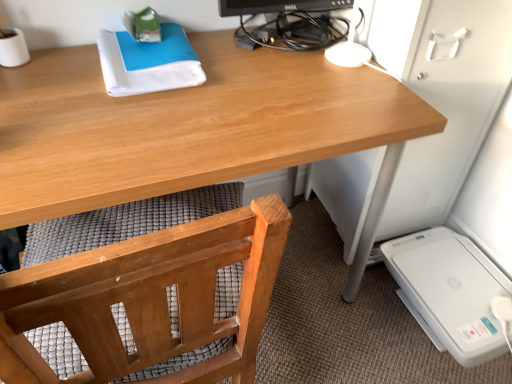
Question: Would you say wooden desk at center is outside white plastic printer at lower right?

Choices:
 (A) no
 (B) yes

Answer: (B)

Question: Does wooden desk at center contain white plastic printer at lower right?

Choices:
 (A) yes
 (B) no

Answer: (B)

Question: Considering the relative positions of wooden desk at center and white plastic printer at lower right in the image provided, is wooden desk at center in front of white plastic printer at lower right?

Choices:
 (A) no
 (B) yes

Answer: (B)

Question: Can you confirm if wooden desk at center is wider than white plastic printer at lower right?

Choices:
 (A) no
 (B) yes

Answer: (B)

Question: Is wooden desk at center oriented away from white plastic printer at lower right?

Choices:
 (A) yes
 (B) no

Answer: (B)

Question: Is wooden desk at center facing towards white plastic printer at lower right?

Choices:
 (A) no
 (B) yes

Answer: (A)

Question: Does wooden desk at center have a greater height compared to wooden chair at lower left?

Choices:
 (A) yes
 (B) no

Answer: (A)

Question: Can you confirm if wooden desk at center is positioned to the right of wooden chair at lower left?

Choices:
 (A) yes
 (B) no

Answer: (A)

Question: Is the surface of wooden desk at center in direct contact with wooden chair at lower left?

Choices:
 (A) yes
 (B) no

Answer: (B)

Question: From a real-world perspective, is wooden desk at center physically below wooden chair at lower left?

Choices:
 (A) yes
 (B) no

Answer: (A)

Question: Is wooden desk at center aimed at wooden chair at lower left?

Choices:
 (A) no
 (B) yes

Answer: (B)

Question: From the image's perspective, does wooden desk at center appear higher than wooden chair at lower left?

Choices:
 (A) no
 (B) yes

Answer: (B)

Question: Is wooden chair at lower left positioned with its back to wooden desk at center?

Choices:
 (A) yes
 (B) no

Answer: (B)